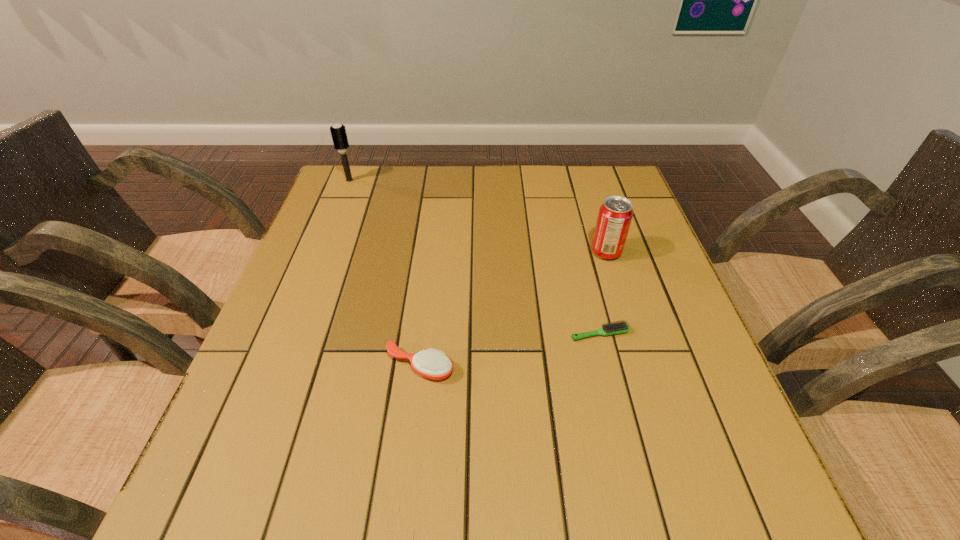
What are the coordinates of `free spot between the second object from left to right and the shortest hairbrush` in the screenshot? It's located at (510, 349).

I want to click on vacant area that lies between the leftmost hairbrush and the soda, so click(478, 216).

Identify the location of free spot between the third nearest object and the second nearest hairbrush. (603, 293).

Find the location of a particular element. free space between the second nearest object and the nearest object is located at coordinates (510, 349).

Identify which object is the third nearest to the tallest object. Please provide its 2D coordinates. Your answer should be formatted as a tuple, i.e. [(x, y)], where the tuple contains the x and y coordinates of a point satisfying the conditions above.

[(615, 328)]

Identify the location of object that is the third closest to the second farthest hairbrush. point(338,132).

This screenshot has height=540, width=960. I want to click on the second closest hairbrush relative to the farthest object, so click(615, 328).

Identify which hairbrush is the closest to the nearest object. Please provide its 2D coordinates. Your answer should be formatted as a tuple, i.e. [(x, y)], where the tuple contains the x and y coordinates of a point satisfying the conditions above.

[(615, 328)]

This screenshot has width=960, height=540. Identify the location of blank area in the image that satisfies the following two spatial constraints: 1. on the front side of the soda; 2. on the left side of the tallest object. (321, 252).